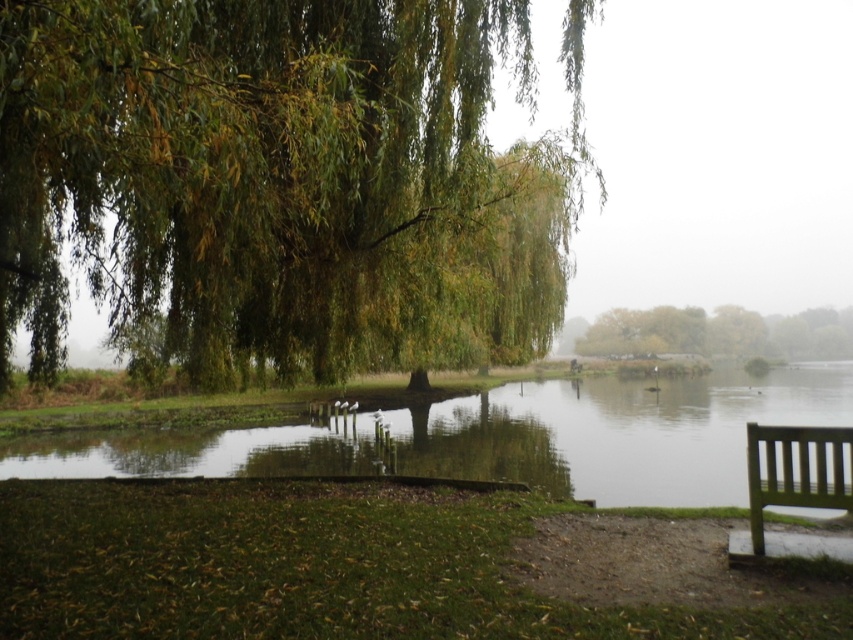
Question: Which object appears closest to the camera in this image?

Choices:
 (A) green leafy tree at center
 (B) clear water at lower left

Answer: (B)

Question: Can you confirm if green leafy willow at upper left is positioned to the right of green leafy tree at center?

Choices:
 (A) no
 (B) yes

Answer: (A)

Question: Which object appears farthest from the camera in this image?

Choices:
 (A) green wooden bench at lower right
 (B) green leafy tree at center
 (C) clear water at lower left
 (D) green leafy willow at upper left

Answer: (B)

Question: Is green leafy willow at upper left to the right of green wooden bench at lower right from the viewer's perspective?

Choices:
 (A) no
 (B) yes

Answer: (A)

Question: Which point appears closest to the camera in this image?

Choices:
 (A) (850, 332)
 (B) (689, 468)
 (C) (323, 292)

Answer: (C)

Question: Can you confirm if clear water at lower left is wider than green wooden bench at lower right?

Choices:
 (A) no
 (B) yes

Answer: (B)